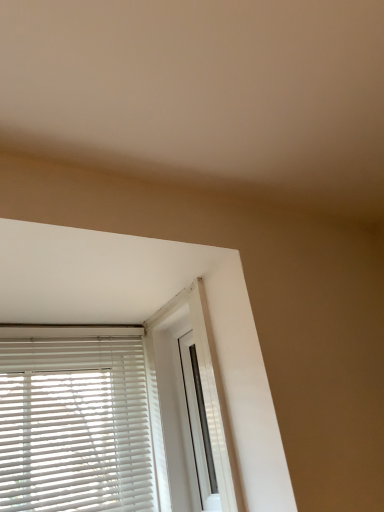
This screenshot has height=512, width=384. What are the coordinates of `white plastic window frame at upper left` in the screenshot? It's located at (208, 390).

The width and height of the screenshot is (384, 512). Describe the element at coordinates (208, 390) in the screenshot. I see `white plastic window frame at upper left` at that location.

Identify the location of white plastic window frame at upper left. (208, 390).